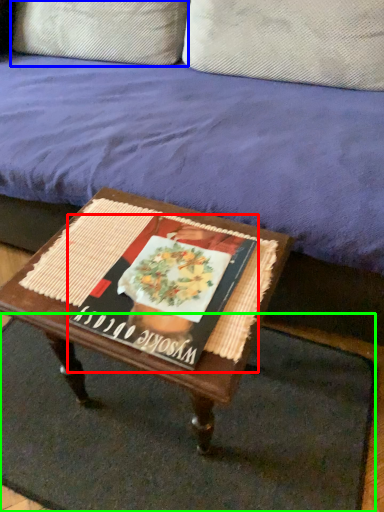
Question: Which is nearer to the magazine (highlighted by a red box)? pillow (highlighted by a blue box) or doormat (highlighted by a green box).

Choices:
 (A) pillow
 (B) doormat

Answer: (B)